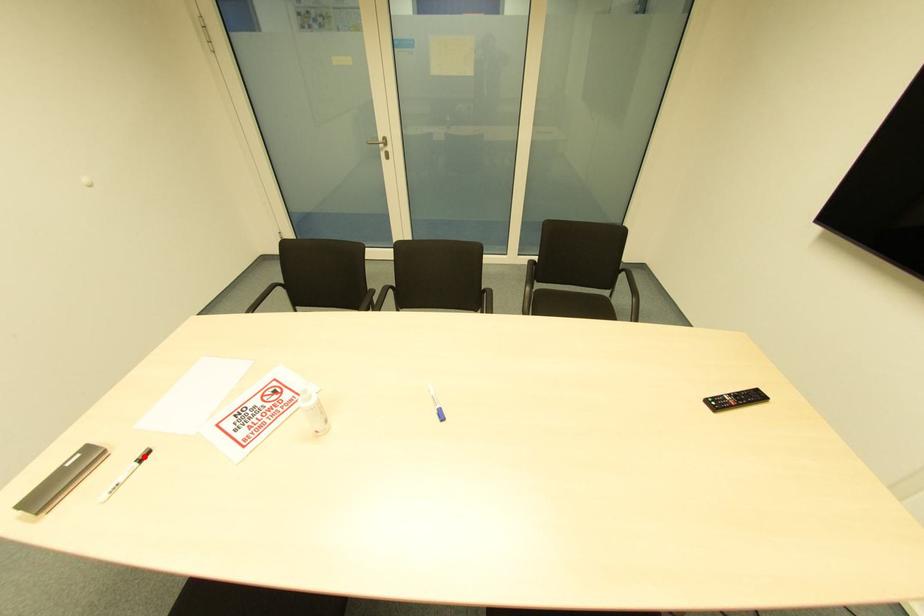
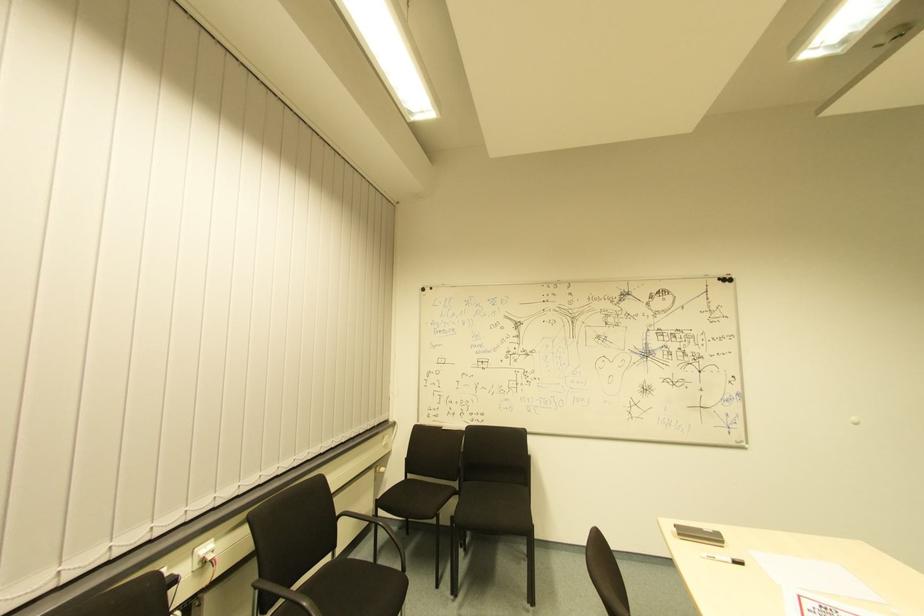
In the second image, find the point that corresponds to the highlighted location in the first image.

(737, 565)